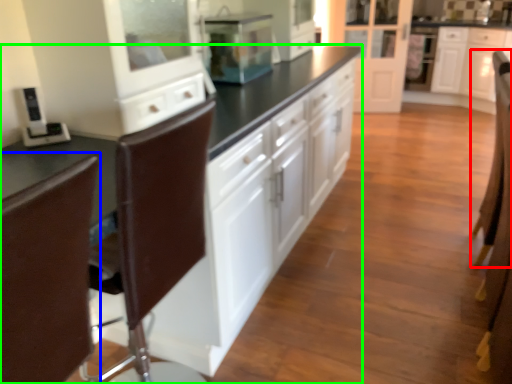
Question: Which object is the closest to the armchair (highlighted by a red box)? Choose among these: swivel chair (highlighted by a blue box) or cabinetry (highlighted by a green box).

Choices:
 (A) swivel chair
 (B) cabinetry

Answer: (B)